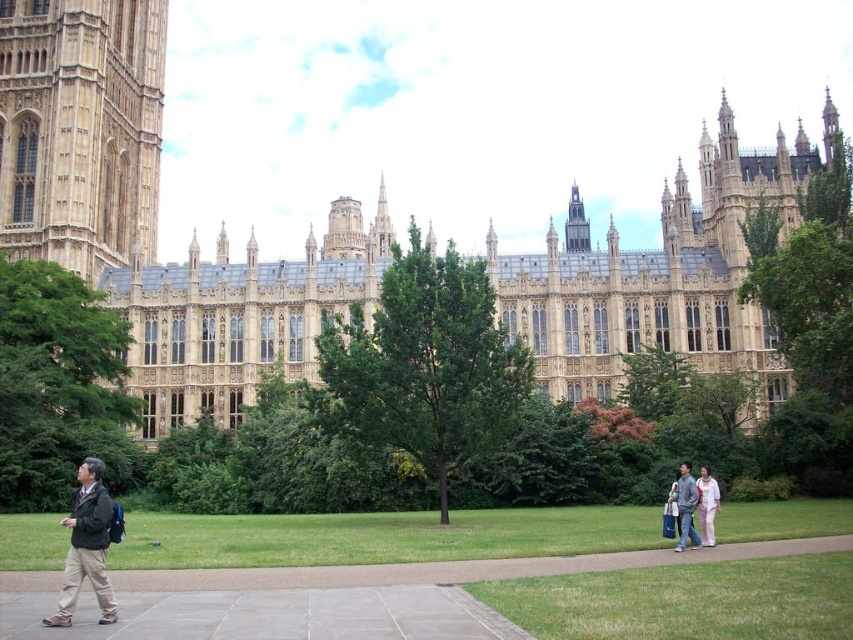
Which is in front, point (140, 104) or point (701, 497)?

Positioned in front is point (701, 497).

Is yellow stone building at center bigger than light pink fabric pants at lower right?

Yes, yellow stone building at center is bigger than light pink fabric pants at lower right.

Does point (53, 122) come closer to viewer compared to point (700, 509)?

No, it is not.

Locate an element on the screen. This screenshot has width=853, height=640. yellow stone building at center is located at coordinates (154, 214).

Does gray cotton jacket at lower right appear on the left side of light pink fabric pants at lower right?

Indeed, gray cotton jacket at lower right is positioned on the left side of light pink fabric pants at lower right.

Does gray cotton jacket at lower right have a larger size compared to light pink fabric pants at lower right?

Indeed, gray cotton jacket at lower right has a larger size compared to light pink fabric pants at lower right.

This screenshot has width=853, height=640. Find the location of `gray cotton jacket at lower right`. gray cotton jacket at lower right is located at coordinates (686, 508).

Can you confirm if golden stone tower at upper left is wider than dark gray stone bell tower at center?

Yes.

What do you see at coordinates (80, 129) in the screenshot? I see `golden stone tower at upper left` at bounding box center [80, 129].

What are the coordinates of `golden stone tower at upper left` in the screenshot? It's located at (80, 129).